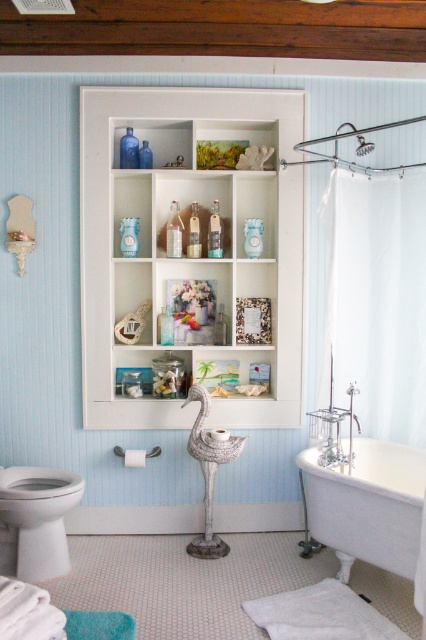
Question: Can you confirm if white matte cabinet at center is positioned above white fabric shower curtain at right?

Choices:
 (A) no
 (B) yes

Answer: (B)

Question: Which point is farther from the camera taking this photo?

Choices:
 (A) (416, 419)
 (B) (98, 308)
 (C) (19, 509)

Answer: (B)

Question: Which point is closer to the camera?

Choices:
 (A) white fabric shower curtain at right
 (B) white matte cabinet at center
 (C) white porcelain bathtub at lower right

Answer: (C)

Question: Which of these objects is positioned farthest from the white matte cabinet at center?

Choices:
 (A) white porcelain bathtub at lower right
 (B) white glossy toilet bowl at lower left
 (C) white fabric shower curtain at right

Answer: (A)

Question: Is white matte cabinet at center to the left of white glossy toilet bowl at lower left from the viewer's perspective?

Choices:
 (A) yes
 (B) no

Answer: (B)

Question: Can you confirm if white matte cabinet at center is positioned below white porcelain bathtub at lower right?

Choices:
 (A) yes
 (B) no

Answer: (B)